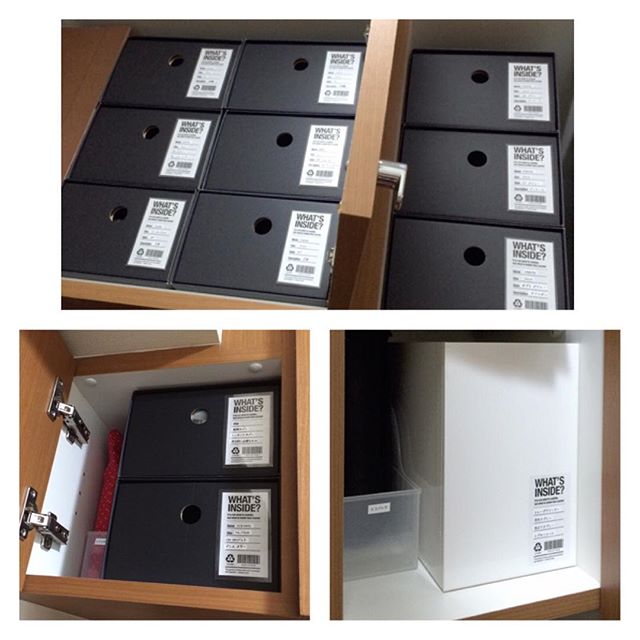
Image resolution: width=640 pixels, height=640 pixels. I want to click on handle, so click(390, 182).